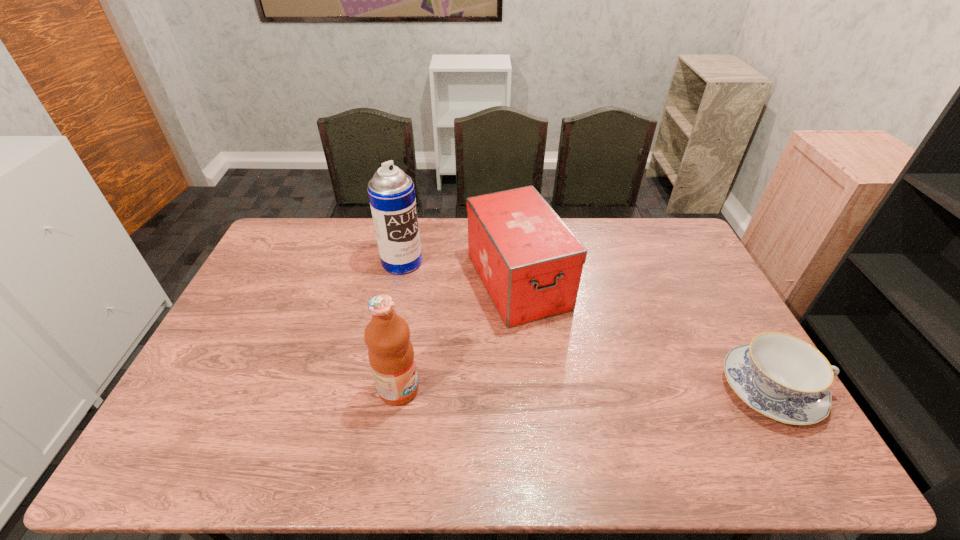
The height and width of the screenshot is (540, 960). What are the coordinates of `vacant area that lies between the first-aid kit and the rightmost object` in the screenshot? It's located at (645, 335).

Find the location of a particular element. The width and height of the screenshot is (960, 540). empty space that is in between the fruit juice and the chinaware is located at coordinates (585, 389).

Image resolution: width=960 pixels, height=540 pixels. Find the location of `free space between the chinaware and the aerosol can`. free space between the chinaware and the aerosol can is located at coordinates (587, 326).

Locate an element on the screen. The image size is (960, 540). object that ranks as the second closest to the tallest object is located at coordinates (391, 355).

Locate an element on the screen. The height and width of the screenshot is (540, 960). object that can be found as the second closest to the rightmost object is located at coordinates (391, 355).

Find the location of a particular element. The height and width of the screenshot is (540, 960). vacant region that satisfies the following two spatial constraints: 1. on the front side of the tallest object; 2. with the handle on the side of the rightmost object is located at coordinates (376, 389).

Where is `free point that satisfies the following two spatial constraints: 1. on the front side of the aerosol can; 2. with the handle on the side of the shortest object`? free point that satisfies the following two spatial constraints: 1. on the front side of the aerosol can; 2. with the handle on the side of the shortest object is located at coordinates (376, 389).

Where is `free point that satisfies the following two spatial constraints: 1. on the front side of the chinaware; 2. with the handle on the side of the third object from left to right`? This screenshot has height=540, width=960. free point that satisfies the following two spatial constraints: 1. on the front side of the chinaware; 2. with the handle on the side of the third object from left to right is located at coordinates (528, 389).